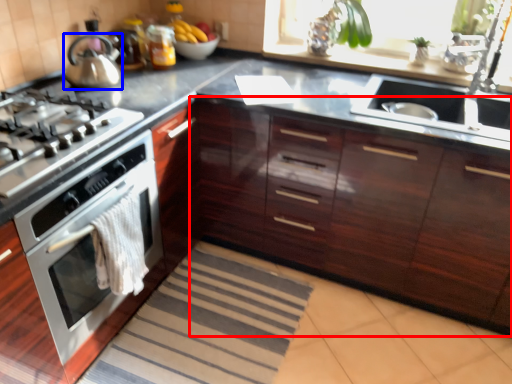
Question: Among these objects, which one is farthest to the camera, cabinetry (highlighted by a red box) or kitchen appliance (highlighted by a blue box)?

Choices:
 (A) cabinetry
 (B) kitchen appliance

Answer: (B)